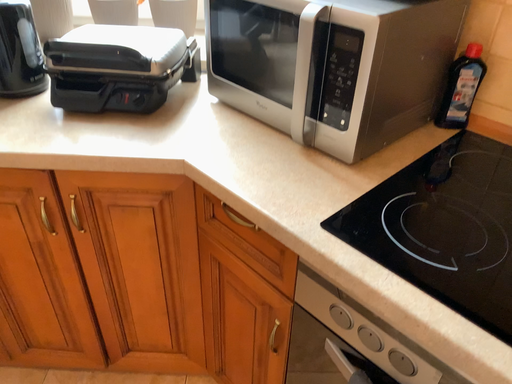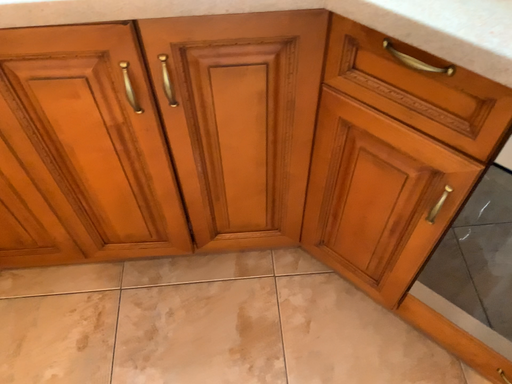
Question: Which way did the camera rotate in the video?

Choices:
 (A) rotated upward
 (B) rotated downward

Answer: (B)